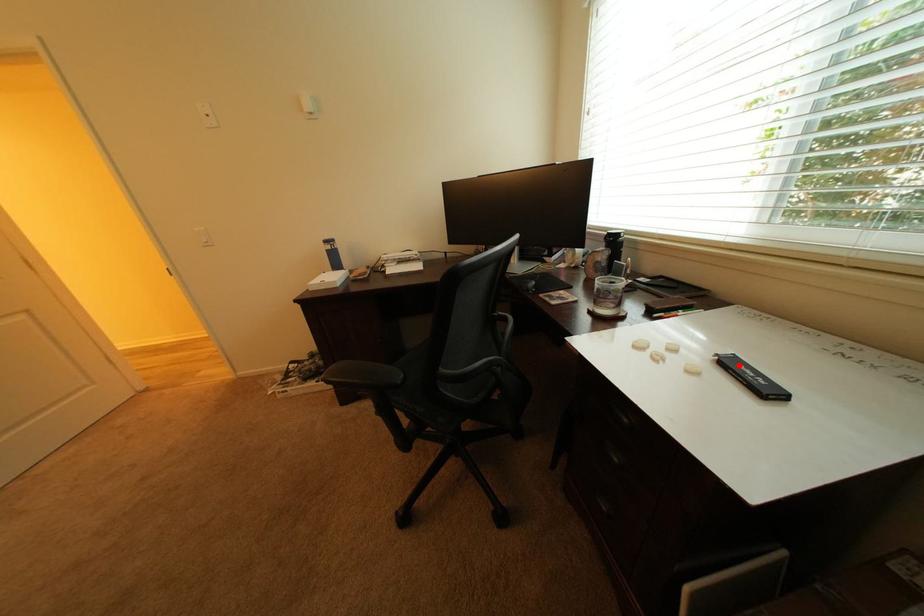
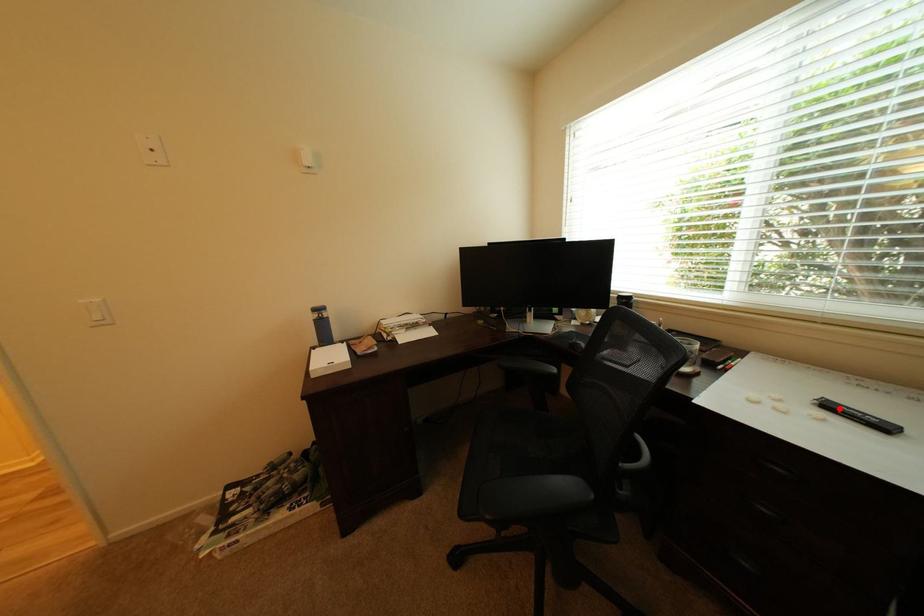
I am providing you with two images of the same scene from different viewpoints. A red point is marked on the first image and another point is marked on the second image. Is the red point in image1 aligned with the point shown in image2?

Yes